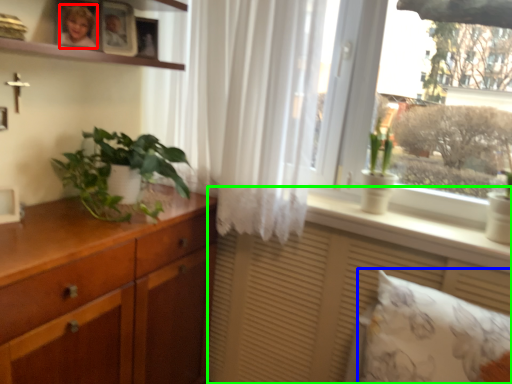
Question: Which object is positioned farthest from person (highlighted by a red box)? Select from pillow (highlighted by a blue box) and vanity (highlighted by a green box).

Choices:
 (A) pillow
 (B) vanity

Answer: (A)